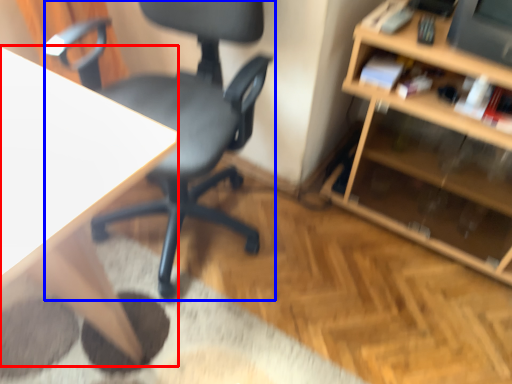
Question: Which object appears closest to the camera in this image, desk (highlighted by a red box) or chair (highlighted by a blue box)?

Choices:
 (A) desk
 (B) chair

Answer: (A)